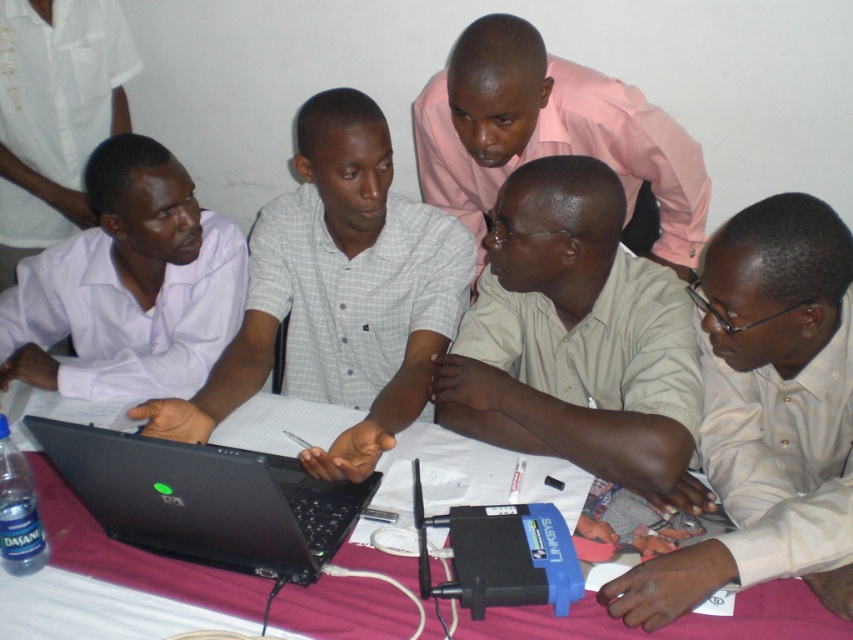
You are standing in front of the table with the red cloth. Where exactly is the beige shirt at lower right located in terms of coordinates?

The beige shirt at lower right is located at coordinates point (769, 413).

You are a photographer taking a picture of the table setup. You notice two points marked on the table surface at coordinates point (694, 216) and point (68, 481). Which point should you focus on to ensure the foreground objects near the camera are sharp?

You should focus on point (694, 216) because it is further to the camera than point (68, 481), ensuring the foreground objects are in focus.